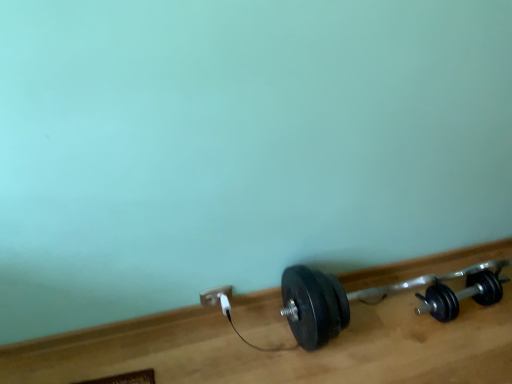
Question: Considering the relative positions of white plastic plug at lower center and black rubber dumbbell at lower right, the 2th dumbbell positioned from the left, in the image provided, is white plastic plug at lower center to the left of black rubber dumbbell at lower right, the 2th dumbbell positioned from the left, from the viewer's perspective?

Choices:
 (A) no
 (B) yes

Answer: (B)

Question: Does white plastic plug at lower center have a smaller size compared to black rubber dumbbell at lower right, the first dumbbell viewed from the right?

Choices:
 (A) yes
 (B) no

Answer: (A)

Question: Can you confirm if white plastic plug at lower center is thinner than black rubber dumbbell at lower right, the first dumbbell viewed from the right?

Choices:
 (A) yes
 (B) no

Answer: (A)

Question: From the image's perspective, would you say white plastic plug at lower center is shown under black rubber dumbbell at lower right, the first dumbbell viewed from the right?

Choices:
 (A) no
 (B) yes

Answer: (B)

Question: From a real-world perspective, is white plastic plug at lower center beneath black rubber dumbbell at lower right, the 2th dumbbell positioned from the left?

Choices:
 (A) yes
 (B) no

Answer: (B)

Question: From a real-world perspective, is white plastic plug at lower center physically located above or below black rubber dumbbell at lower right, which appears as the 1th dumbbell when viewed from the left?

Choices:
 (A) below
 (B) above

Answer: (A)

Question: Based on their sizes in the image, would you say white plastic plug at lower center is bigger or smaller than black rubber dumbbell at lower right, which appears as the 1th dumbbell when viewed from the left?

Choices:
 (A) small
 (B) big

Answer: (A)

Question: Is white plastic plug at lower center wider or thinner than black rubber dumbbell at lower right, which appears as the 1th dumbbell when viewed from the left?

Choices:
 (A) wide
 (B) thin

Answer: (B)

Question: Considering the relative positions of white plastic plug at lower center and black rubber dumbbell at lower right, which is counted as the 2th dumbbell, starting from the right, in the image provided, is white plastic plug at lower center to the left or to the right of black rubber dumbbell at lower right, which is counted as the 2th dumbbell, starting from the right,?

Choices:
 (A) left
 (B) right

Answer: (A)

Question: Is white plastic plug at lower center taller or shorter than black rubber dumbbell at lower right, the 2th dumbbell positioned from the left?

Choices:
 (A) short
 (B) tall

Answer: (A)

Question: From a real-world perspective, is white plastic plug at lower center above or below black rubber dumbbell at lower right, the 2th dumbbell positioned from the left?

Choices:
 (A) above
 (B) below

Answer: (A)

Question: From the image's perspective, is white plastic plug at lower center above or below black rubber dumbbell at lower right, the first dumbbell viewed from the right?

Choices:
 (A) above
 (B) below

Answer: (B)

Question: Considering the positions of white plastic plug at lower center and black rubber dumbbell at lower right, the 2th dumbbell positioned from the left, in the image, is white plastic plug at lower center wider or thinner than black rubber dumbbell at lower right, the 2th dumbbell positioned from the left,?

Choices:
 (A) thin
 (B) wide

Answer: (A)

Question: Is white plastic power plug at lower center taller or shorter than black rubber dumbbell at lower right, which is counted as the 2th dumbbell, starting from the right?

Choices:
 (A) short
 (B) tall

Answer: (A)

Question: Is point (217, 291) closer or farther from the camera than point (327, 331)?

Choices:
 (A) farther
 (B) closer

Answer: (A)